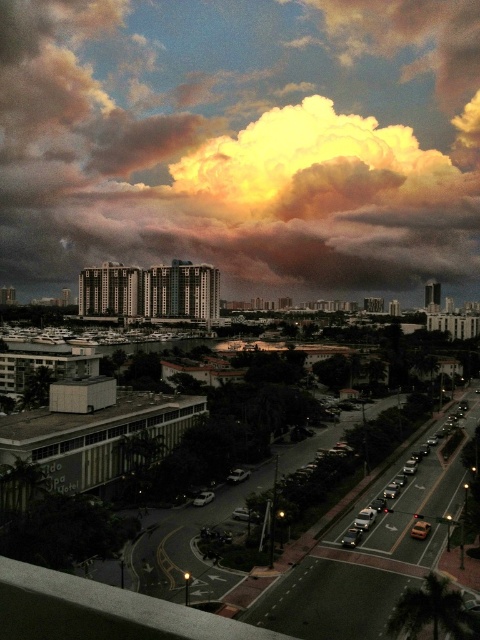
Question: Considering the relative positions of golden textured cloud at upper center and green leafy palm tree at lower right in the image provided, where is golden textured cloud at upper center located with respect to green leafy palm tree at lower right?

Choices:
 (A) left
 (B) right

Answer: (A)

Question: Is golden textured cloud at upper center bigger than green leafy palm tree at lower right?

Choices:
 (A) no
 (B) yes

Answer: (B)

Question: Is golden textured cloud at upper center further to the viewer compared to green leafy palm tree at lower right?

Choices:
 (A) no
 (B) yes

Answer: (B)